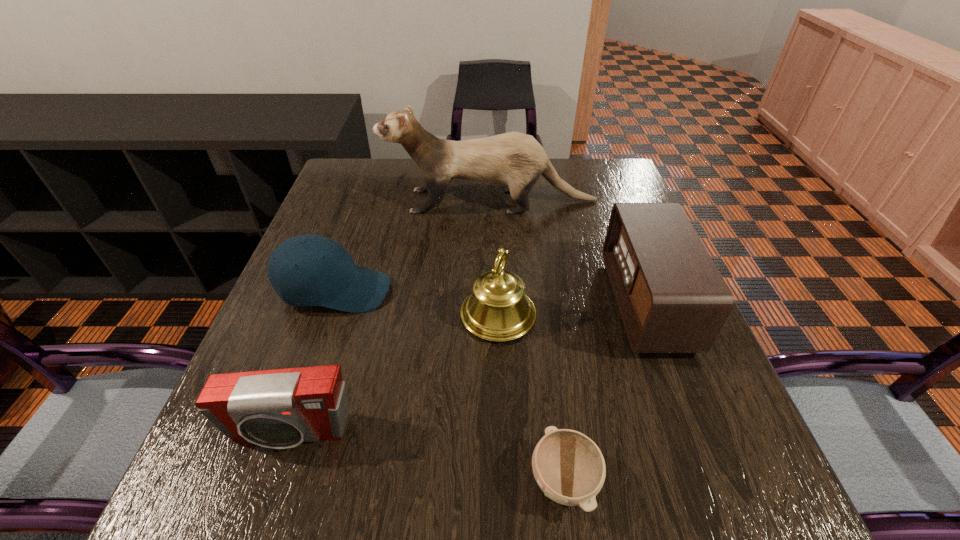
I want to click on camera present at the left edge, so click(x=281, y=408).

At what (x,y) coordinates should I click in order to perform the action: click on ferret located at the right edge. Please return your answer as a coordinate pair (x, y). The height and width of the screenshot is (540, 960). Looking at the image, I should click on (516, 160).

What are the coordinates of `radio receiver that is at the right edge` in the screenshot? It's located at (672, 298).

Locate an element on the screen. This screenshot has height=540, width=960. object that is at the far right corner is located at coordinates (516, 160).

I want to click on free space at the near edge of the desktop, so [x=651, y=498].

At what (x,y) coordinates should I click in order to perform the action: click on free space at the left edge of the desktop. Please return your answer as a coordinate pair (x, y). Looking at the image, I should click on (327, 227).

Locate an element on the screen. The image size is (960, 540). vacant region at the right edge of the desktop is located at coordinates (602, 211).

You are a GUI agent. You are given a task and a screenshot of the screen. Output one action in this format:
    pyautogui.click(x=<x>, y=<y>)
    Task: Click on the blank space at the far left corner
    
    Given the screenshot: What is the action you would take?
    pyautogui.click(x=372, y=181)

Identify the location of free space at the near left corner of the desktop. The width and height of the screenshot is (960, 540). (227, 474).

This screenshot has width=960, height=540. In the image, there is a desktop. What are the coordinates of `blank space at the far right corner` in the screenshot? It's located at point(610,187).